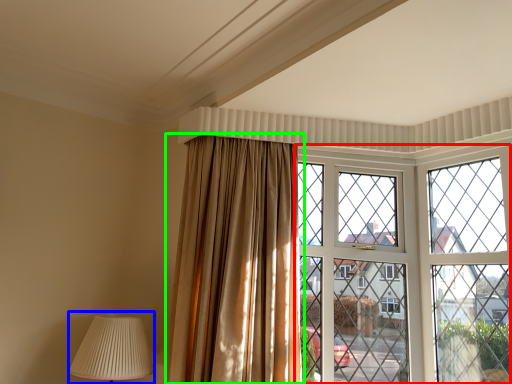
Question: Estimate the real-world distances between objects in this image. Which object is farther from window (highlighted by a red box), table lamp (highlighted by a blue box) or curtain (highlighted by a green box)?

Choices:
 (A) table lamp
 (B) curtain

Answer: (A)